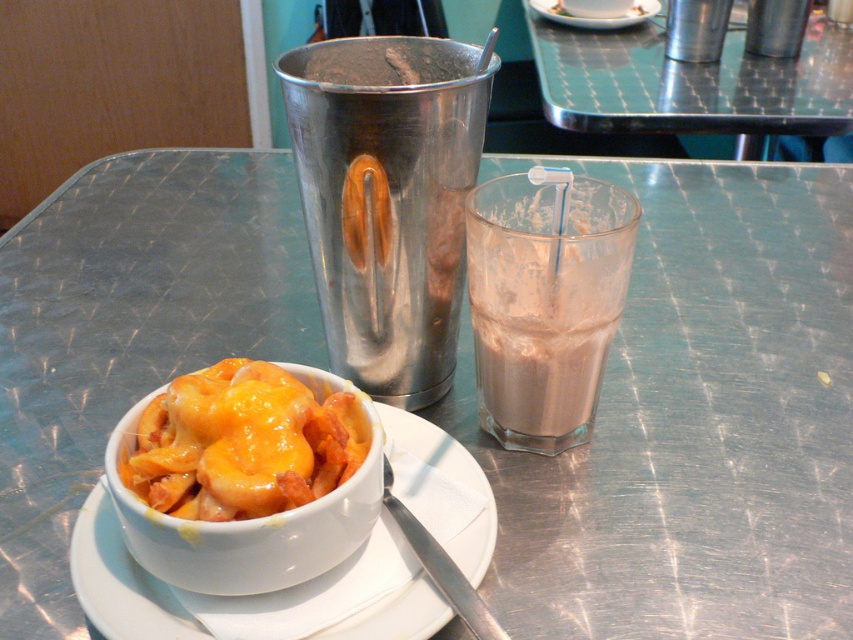
Question: Which point appears closest to the camera in this image?

Choices:
 (A) (585, 26)
 (B) (206, 406)
 (C) (637, 13)

Answer: (B)

Question: Which object is positioned farthest from the chocolate milkshake at right?

Choices:
 (A) brushed metal table at upper center
 (B) white paper saucer at upper center
 (C) brushed metal shaker at upper center

Answer: (B)

Question: Does cheesy bread at center appear on the left side of white paper saucer at upper center?

Choices:
 (A) no
 (B) yes

Answer: (B)

Question: Which is farther from the brushed metal shaker at upper center?

Choices:
 (A) white ceramic saucer at lower left
 (B) cheesy bread at center

Answer: (A)

Question: Is brushed metal table at upper center in front of white paper saucer at upper center?

Choices:
 (A) yes
 (B) no

Answer: (A)

Question: Does brushed metal table at upper center have a greater width compared to matte white bowl at lower left?

Choices:
 (A) yes
 (B) no

Answer: (A)